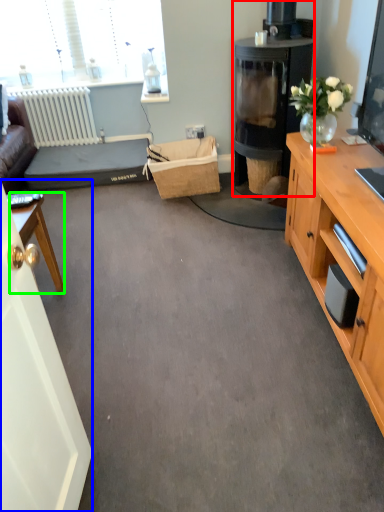
Question: Which object is the farthest from fireplace (highlighted by a red box)? Choose among these: glass door (highlighted by a blue box) or desk (highlighted by a green box).

Choices:
 (A) glass door
 (B) desk

Answer: (A)